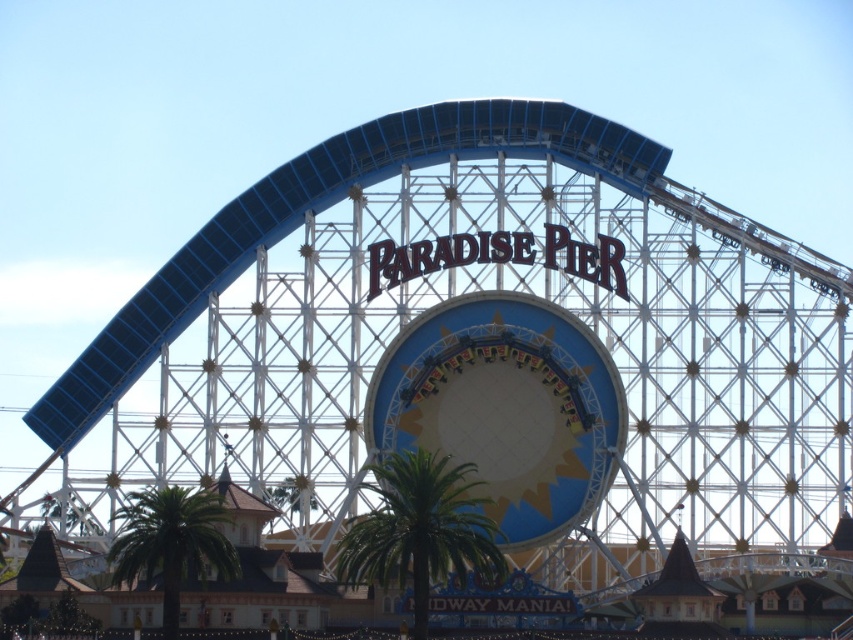
Does matte blue and white amusement ride at center appear under green leafy palm tree at center?

No.

Between matte blue and white amusement ride at center and green leafy palm tree at center, which one has more height?

matte blue and white amusement ride at center is taller.

Which is behind, point (405, 433) or point (471, 547)?

The point (405, 433) is more distant.

Locate an element on the screen. This screenshot has height=640, width=853. matte blue and white amusement ride at center is located at coordinates (505, 406).

Is matte blue and white amusement ride at center to the right of green leafy palm tree at lower left from the viewer's perspective?

Indeed, matte blue and white amusement ride at center is positioned on the right side of green leafy palm tree at lower left.

Consider the image. Which is more to the left, matte blue and white amusement ride at center or green leafy palm tree at lower left?

green leafy palm tree at lower left is more to the left.

Does point (608, 442) come in front of point (223, 561)?

No, (608, 442) is further to viewer.

This screenshot has height=640, width=853. I want to click on matte blue and white amusement ride at center, so click(505, 406).

Which of these two, green leafy palm tree at center or green leafy palm tree at lower left, stands shorter?

green leafy palm tree at lower left

Between green leafy palm tree at center and green leafy palm tree at lower left, which one is positioned higher?

green leafy palm tree at center is higher up.

Who is more forward, (x=444, y=497) or (x=213, y=522)?

Point (x=444, y=497) is more forward.

This screenshot has width=853, height=640. In order to click on green leafy palm tree at center in this screenshot , I will do pos(421,531).